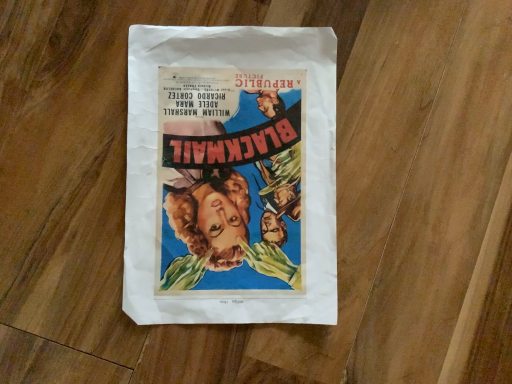
The height and width of the screenshot is (384, 512). What do you see at coordinates (231, 176) in the screenshot?
I see `vintage paper poster at center` at bounding box center [231, 176].

Measure the distance between point (301, 63) and camera.

Point (301, 63) and camera are 43.00 centimeters apart from each other.

Image resolution: width=512 pixels, height=384 pixels. Find the location of `vintage paper poster at center`. vintage paper poster at center is located at coordinates (231, 176).

Where is `vintage paper poster at center`? vintage paper poster at center is located at coordinates point(231,176).